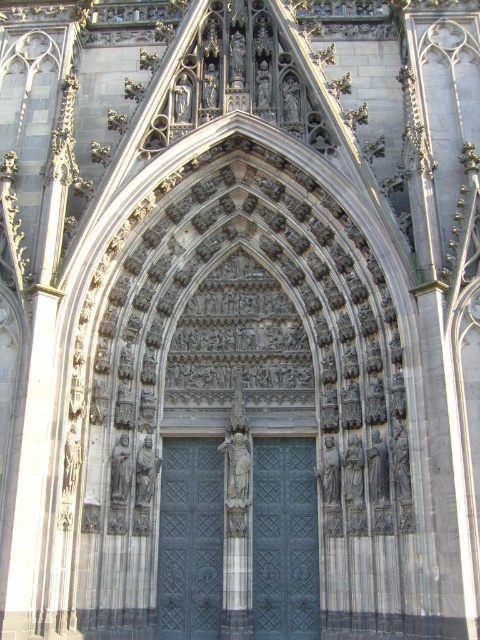
Question: Is dark blue metal door at center above dark gray metal door at center?

Choices:
 (A) yes
 (B) no

Answer: (A)

Question: Among these points, which one is farthest from the camera?

Choices:
 (A) (268, 561)
 (B) (212, 467)

Answer: (B)

Question: Does dark blue metal door at center lie in front of dark gray metal door at center?

Choices:
 (A) yes
 (B) no

Answer: (A)

Question: Observing the image, what is the correct spatial positioning of dark blue metal door at center in reference to dark gray metal door at center?

Choices:
 (A) right
 (B) left

Answer: (A)